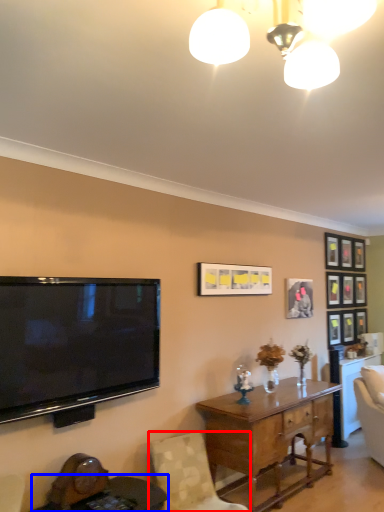
Question: Among these objects, which one is nearest to the camera, chair (highlighted by a red box) or round table (highlighted by a blue box)?

Choices:
 (A) chair
 (B) round table

Answer: (B)